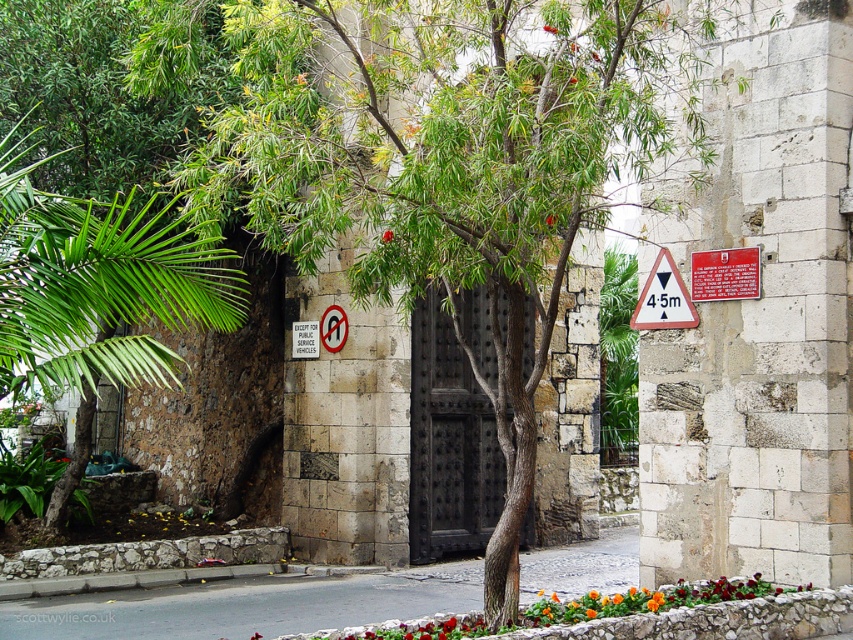
Does green leafy tree at center appear on the right side of orange matte flower bed at lower center?

Incorrect, green leafy tree at center is not on the right side of orange matte flower bed at lower center.

Does green leafy tree at center lie behind orange matte flower bed at lower center?

No, green leafy tree at center is closer to the viewer.

The width and height of the screenshot is (853, 640). What do you see at coordinates (451, 164) in the screenshot?
I see `green leafy tree at center` at bounding box center [451, 164].

The width and height of the screenshot is (853, 640). I want to click on green leafy tree at center, so pyautogui.click(x=451, y=164).

Is point (444, 396) positioned behind point (663, 307)?

That is True.

From the picture: Who is more distant from viewer, (525,369) or (676,304)?

The point (525,369) is more distant.

The height and width of the screenshot is (640, 853). What are the coordinates of `black wrought iron door at center` in the screenshot? It's located at (448, 442).

Is black wrought iron door at center to the left of red matte flower at center from the viewer's perspective?

Correct, you'll find black wrought iron door at center to the left of red matte flower at center.

How far apart are black wrought iron door at center and red matte flower at center?

black wrought iron door at center and red matte flower at center are 6.32 meters apart.

Measure the distance between black wrought iron door at center and camera.

They are 39.62 feet apart.

Identify the location of black wrought iron door at center. (448, 442).